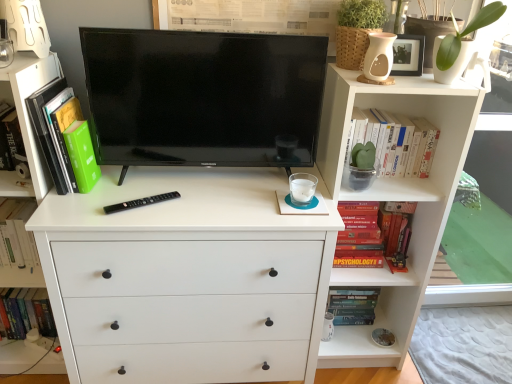
Where is `free space in front of green matte book at left, the 4th book from the right`? Image resolution: width=512 pixels, height=384 pixels. free space in front of green matte book at left, the 4th book from the right is located at coordinates (71, 213).